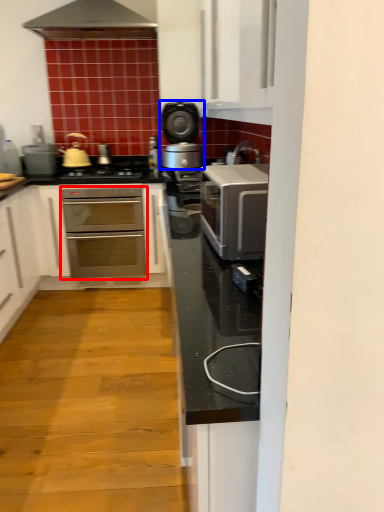
Question: Which object appears farthest to the camera in this image, oven (highlighted by a red box) or home appliance (highlighted by a blue box)?

Choices:
 (A) oven
 (B) home appliance

Answer: (A)